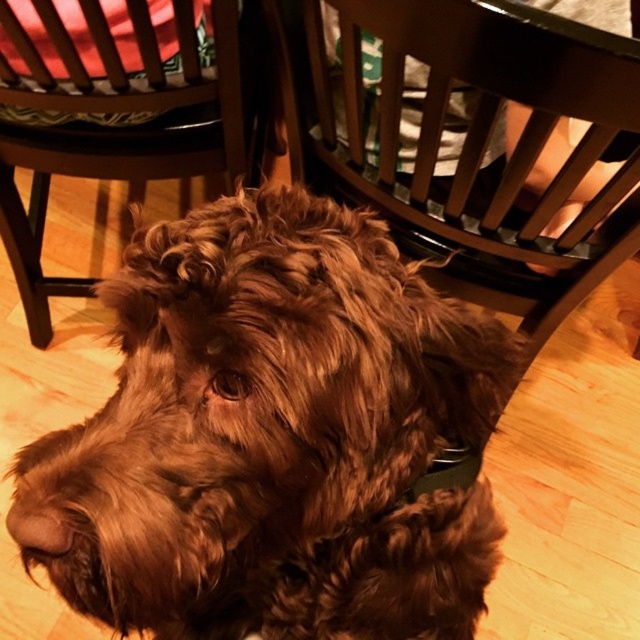
Question: Can you confirm if wooden chair at center is bigger than wooden chair at upper left?

Choices:
 (A) no
 (B) yes

Answer: (A)

Question: Which of the following is the farthest from the observer?

Choices:
 (A) (97, 499)
 (B) (109, 33)

Answer: (B)

Question: Which point appears farthest from the camera in this image?

Choices:
 (A) (108, 100)
 (B) (380, 392)
 (C) (616, 166)

Answer: (A)

Question: Can you confirm if brown curly fur dog at center is thinner than wooden chair at center?

Choices:
 (A) no
 (B) yes

Answer: (B)

Question: Is brown curly fur dog at center above wooden chair at upper left?

Choices:
 (A) no
 (B) yes

Answer: (A)

Question: Which point is farther to the camera?

Choices:
 (A) (188, 52)
 (B) (372, 620)
 (C) (419, 74)

Answer: (A)